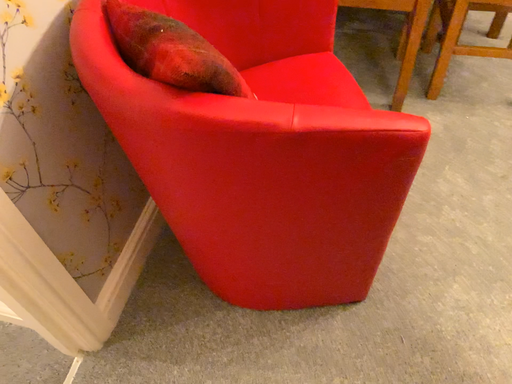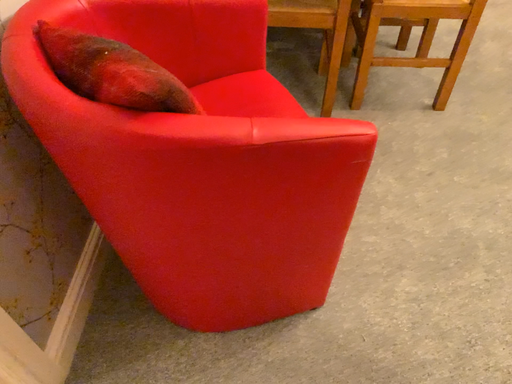
Question: Which way did the camera rotate in the video?

Choices:
 (A) rotated left
 (B) rotated right

Answer: (B)